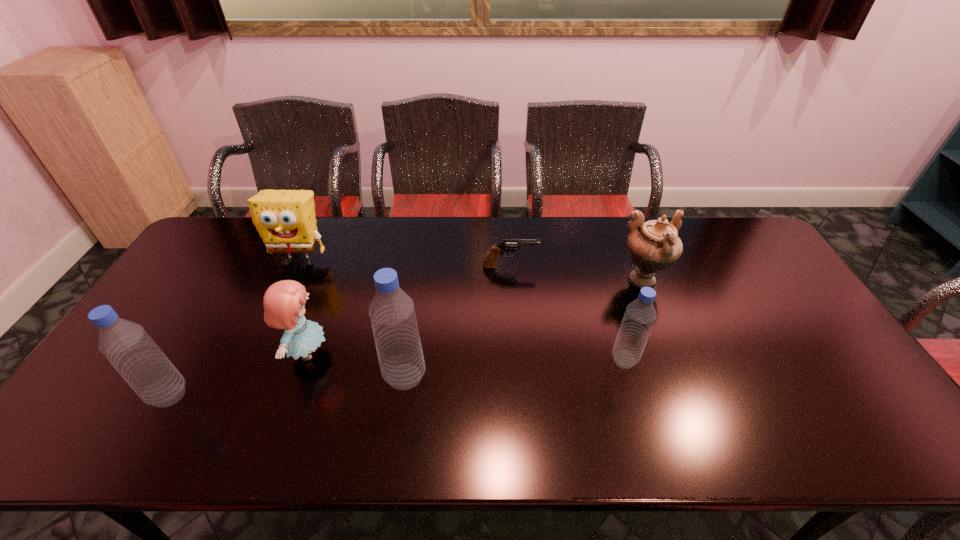
You are a GUI agent. You are given a task and a screenshot of the screen. Output one action in this format:
    pyautogui.click(x=<x>, y=<y>)
    Task: Click on the vacant area that lies between the second bottle from right to left and the shortest bottle
    This screenshot has width=960, height=540.
    Given the screenshot: What is the action you would take?
    pyautogui.click(x=515, y=368)

At what (x,y) coordinates should I click in order to perform the action: click on vacant space in between the sponge and the second shortest bottle. Please return your answer as a coordinate pair (x, y). This screenshot has height=540, width=960. Looking at the image, I should click on (234, 328).

This screenshot has height=540, width=960. Identify the location of vacant region between the fifth object from left to right and the second shortest bottle. (340, 330).

Locate an element on the screen. vacant area between the doll and the urn is located at coordinates (475, 317).

Identify the location of vacant area that lies between the sponge and the second bottle from right to left. This screenshot has height=540, width=960. (352, 319).

This screenshot has width=960, height=540. I want to click on free space between the third object from right to left and the fourth object from left to right, so click(x=458, y=321).

The width and height of the screenshot is (960, 540). I want to click on object that can be found as the third closest to the doll, so click(x=285, y=219).

This screenshot has height=540, width=960. I want to click on object that stands as the closest to the urn, so click(640, 314).

Identify which bottle is located as the second nearest to the second bottle from left to right. Please provide its 2D coordinates. Your answer should be formatted as a tuple, i.e. [(x, y)], where the tuple contains the x and y coordinates of a point satisfying the conditions above.

[(640, 314)]

Identify the location of bottle that stands as the second closest to the gun. (392, 313).